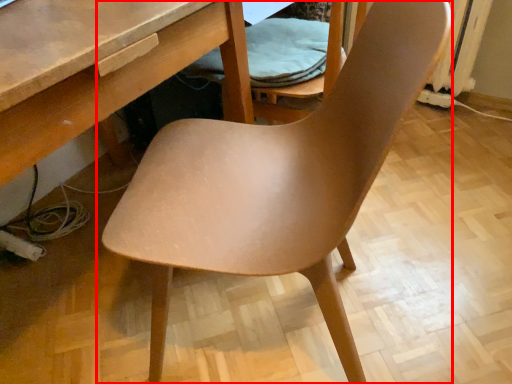
Question: In this image, where is chair (annotated by the red box) located relative to folding chair?

Choices:
 (A) left
 (B) right

Answer: (A)